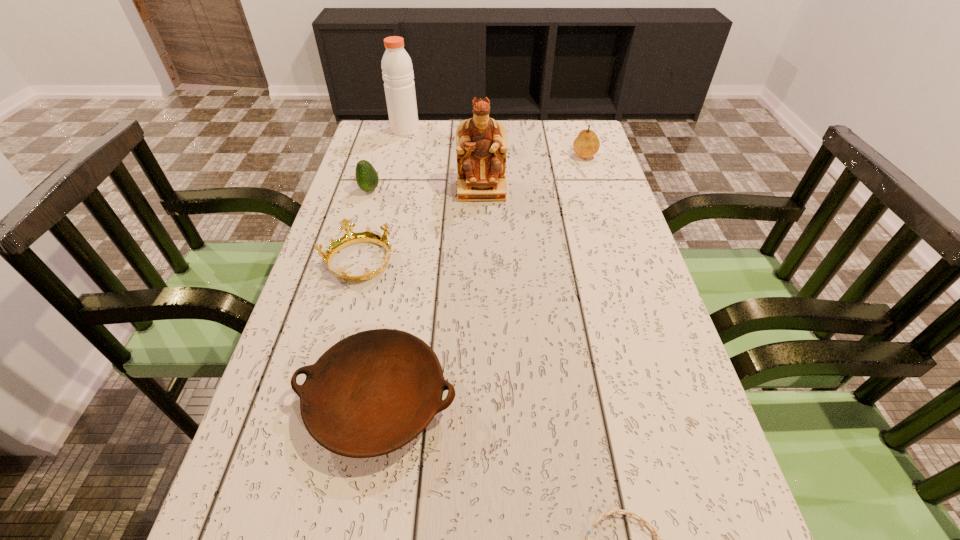
You are a GUI agent. You are given a task and a screenshot of the screen. Output one action in this format:
    pyautogui.click(x=<x>, y=<y>)
    Task: Click on the object at the far left corner
    This screenshot has height=540, width=960.
    Given the screenshot: What is the action you would take?
    pyautogui.click(x=397, y=69)

Locate an element on the screen. The image size is (960, 540). object situated at the far right corner is located at coordinates (586, 145).

In the image, there is a desktop. What are the coordinates of `vacant area at the far edge` in the screenshot? It's located at (446, 145).

Find the location of `free space at the left edge of the desktop`. free space at the left edge of the desktop is located at coordinates tap(315, 288).

This screenshot has width=960, height=540. What are the coordinates of `vacant space at the right edge of the desktop` in the screenshot? It's located at (629, 287).

What are the coordinates of `free space at the far left corner of the desktop` in the screenshot? It's located at (364, 149).

Where is `free space at the far right corner of the desktop`? Image resolution: width=960 pixels, height=540 pixels. free space at the far right corner of the desktop is located at coordinates (575, 136).

What are the coordinates of `empty space that is in between the crown and the figurine` in the screenshot? It's located at (420, 226).

Locate an element on the screen. free space between the sixth farthest object and the rightmost object is located at coordinates coord(480,277).

Locate an element on the screen. blank region between the sixth farthest object and the figurine is located at coordinates (429, 295).